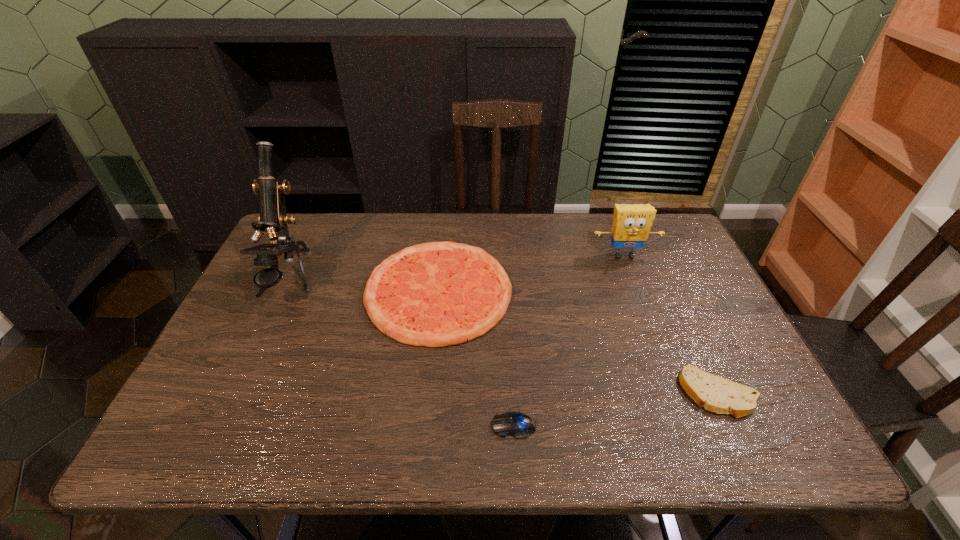
Find the location of `the tallest object`. the tallest object is located at coordinates (272, 219).

At what (x,y) coordinates should I click in order to perform the action: click on microscope. Please return your answer as a coordinate pair (x, y). Looking at the image, I should click on (272, 219).

At what (x,y) coordinates should I click in order to perform the action: click on sponge. Please return your answer as a coordinate pair (x, y). The height and width of the screenshot is (540, 960). Looking at the image, I should click on (631, 224).

Locate an element on the screen. pizza is located at coordinates (436, 294).

Where is `pita bread`? pita bread is located at coordinates (716, 394).

The height and width of the screenshot is (540, 960). I want to click on computer mouse, so click(x=519, y=425).

At what (x,y) coordinates should I click in order to perform the action: click on free spot located through the eyepiece of the leftmost object. Please return your answer as a coordinate pair (x, y). Image resolution: width=960 pixels, height=540 pixels. Looking at the image, I should click on (267, 327).

This screenshot has height=540, width=960. Identify the location of vacant region located 0.380m on the face of the sponge. (667, 369).

At what (x,y) coordinates should I click in order to perform the action: click on vacant region located on the right of the pizza. Please return your answer as a coordinate pair (x, y). Looking at the image, I should click on (633, 291).

Identify the location of free spot located 0.140m on the back of the pita bread. (686, 325).